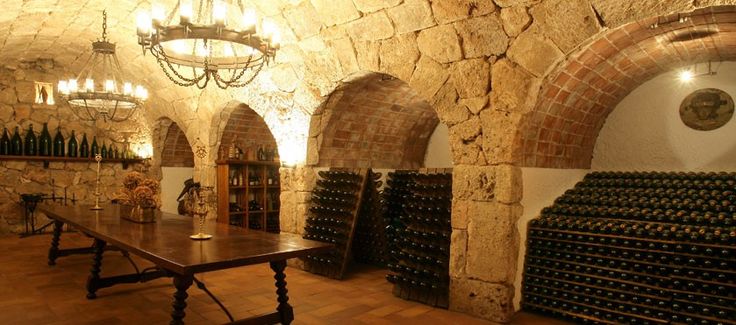
The height and width of the screenshot is (325, 736). What are the coordinates of `table` in the screenshot? It's located at (277, 244).